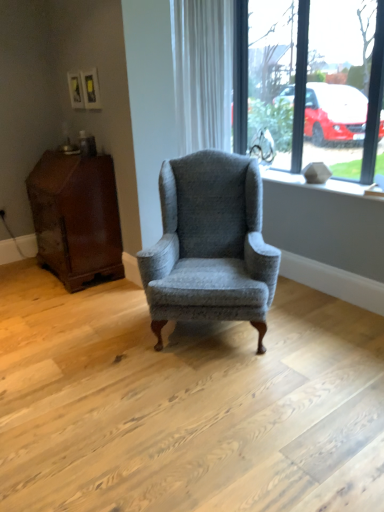
Question: Is mahogany wood side table at left aimed at white textured curtain at upper center?

Choices:
 (A) yes
 (B) no

Answer: (B)

Question: Is the position of mahogany wood side table at left less distant than that of white textured curtain at upper center?

Choices:
 (A) no
 (B) yes

Answer: (A)

Question: Is mahogany wood side table at left bigger than white textured curtain at upper center?

Choices:
 (A) yes
 (B) no

Answer: (A)

Question: Can you confirm if mahogany wood side table at left is thinner than white textured curtain at upper center?

Choices:
 (A) yes
 (B) no

Answer: (B)

Question: Can you confirm if mahogany wood side table at left is taller than white textured curtain at upper center?

Choices:
 (A) yes
 (B) no

Answer: (B)

Question: Is mahogany wood side table at left to the left of white textured curtain at upper center from the viewer's perspective?

Choices:
 (A) no
 (B) yes

Answer: (B)

Question: Is white textured stone at upper right bigger than textured gray wingback chair at center?

Choices:
 (A) yes
 (B) no

Answer: (B)

Question: Considering the relative positions of white textured stone at upper right and textured gray wingback chair at center in the image provided, is white textured stone at upper right to the left of textured gray wingback chair at center from the viewer's perspective?

Choices:
 (A) no
 (B) yes

Answer: (A)

Question: Considering the relative sizes of white textured stone at upper right and textured gray wingback chair at center in the image provided, is white textured stone at upper right smaller than textured gray wingback chair at center?

Choices:
 (A) yes
 (B) no

Answer: (A)

Question: Considering the relative sizes of white textured stone at upper right and textured gray wingback chair at center in the image provided, is white textured stone at upper right thinner than textured gray wingback chair at center?

Choices:
 (A) yes
 (B) no

Answer: (A)

Question: From the image's perspective, is white textured stone at upper right below textured gray wingback chair at center?

Choices:
 (A) yes
 (B) no

Answer: (B)

Question: Would you say white textured stone at upper right is a long distance from textured gray wingback chair at center?

Choices:
 (A) no
 (B) yes

Answer: (A)

Question: Is clear glass window at upper right wider than textured gray wingback chair at center?

Choices:
 (A) no
 (B) yes

Answer: (A)